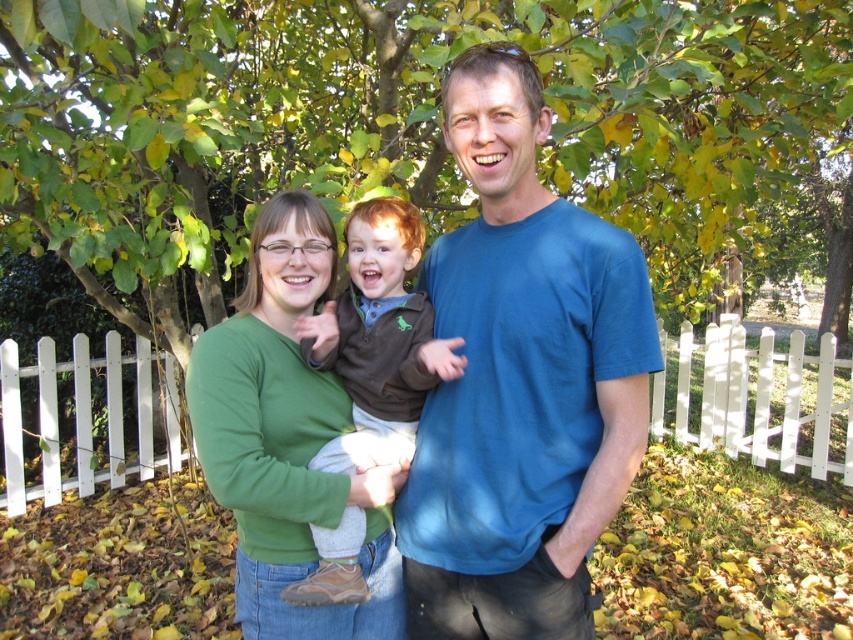
You are standing in the garden and want to take a photo of the white picket fence at center without the brown suede boot at center blocking the view. Which direction should you move to achieve this?

The white picket fence at center is positioned under the brown suede boot at center, so moving backward would allow you to capture the white picket fence at center without the brown suede boot at center obstructing the view.

In the scene shown: You are planning to hang a 3 feet wide painting on the wall between the green matte sweater at center and the white picket fence at center. Is there enough space between them to accommodate the painting?

The distance between the green matte sweater at center and the white picket fence at center is 14.09 feet, which is more than enough to fit a 3 feet wide painting between them.

You are standing in the garden and want to place a small decorative stone between the two points labeled point (264,602) and point (822,362). Which point should the stone be closer to if you want it to appear larger in the photo?

The stone should be placed closer to point (264,602) because it is closer to the camera, making objects placed there appear larger in the photo.